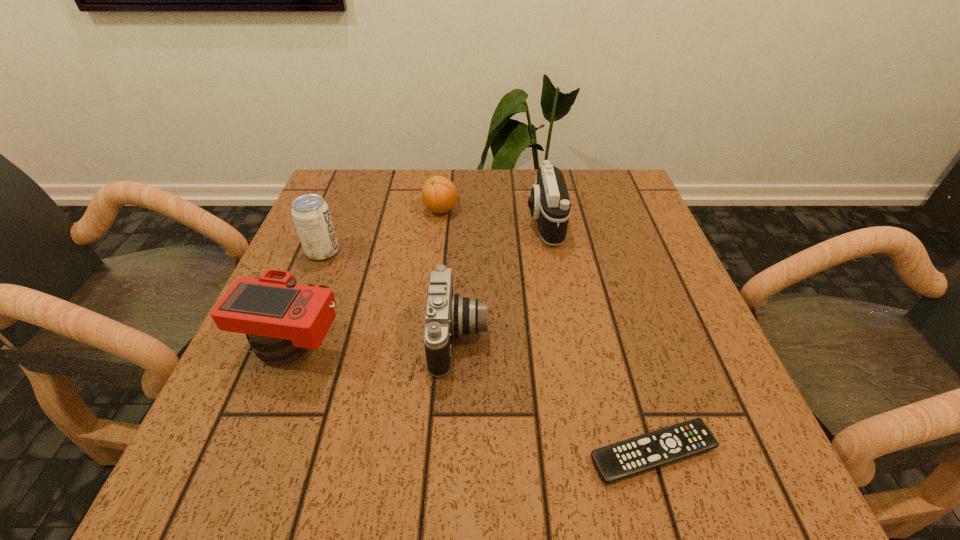
The height and width of the screenshot is (540, 960). I want to click on vacant point located between the soda can and the second camera from right to left, so click(391, 294).

At what (x,y) coordinates should I click in order to perform the action: click on empty location between the leftmost camera and the fifth tallest object. Please return your answer as a coordinate pair (x, y). Image resolution: width=960 pixels, height=540 pixels. Looking at the image, I should click on (369, 278).

At what (x,y) coordinates should I click in order to perform the action: click on free space between the second shortest object and the soda can. Please return your answer as a coordinate pair (x, y). The image size is (960, 540). Looking at the image, I should click on (382, 231).

Locate an element on the screen. blank region between the farthest camera and the second camera from right to left is located at coordinates (501, 279).

The height and width of the screenshot is (540, 960). Find the location of `free space between the nearest object and the leftmost camera`. free space between the nearest object and the leftmost camera is located at coordinates (474, 399).

Identify the location of vacant region between the farthest camera and the orange. (492, 215).

Identify which object is the fourth closest to the second camera from left to right. Please provide its 2D coordinates. Your answer should be formatted as a tuple, i.e. [(x, y)], where the tuple contains the x and y coordinates of a point satisfying the conditions above.

[(311, 215)]

Identify the location of object that can be found as the fourth closest to the second camera from right to left. This screenshot has width=960, height=540. (311, 215).

This screenshot has height=540, width=960. Identify the location of camera identified as the closest to the soda can. (283, 319).

You are a GUI agent. You are given a task and a screenshot of the screen. Output one action in this format:
    pyautogui.click(x=<x>, y=<y>)
    Task: Click on the camera that is the second closest to the rightmost camera
    The image size is (960, 540).
    Given the screenshot: What is the action you would take?
    pyautogui.click(x=283, y=319)